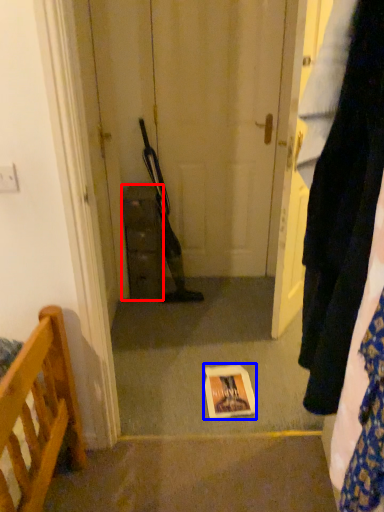
Question: Which object appears closest to the camera in this image, cabinetry (highlighted by a red box) or copy (highlighted by a blue box)?

Choices:
 (A) cabinetry
 (B) copy

Answer: (B)